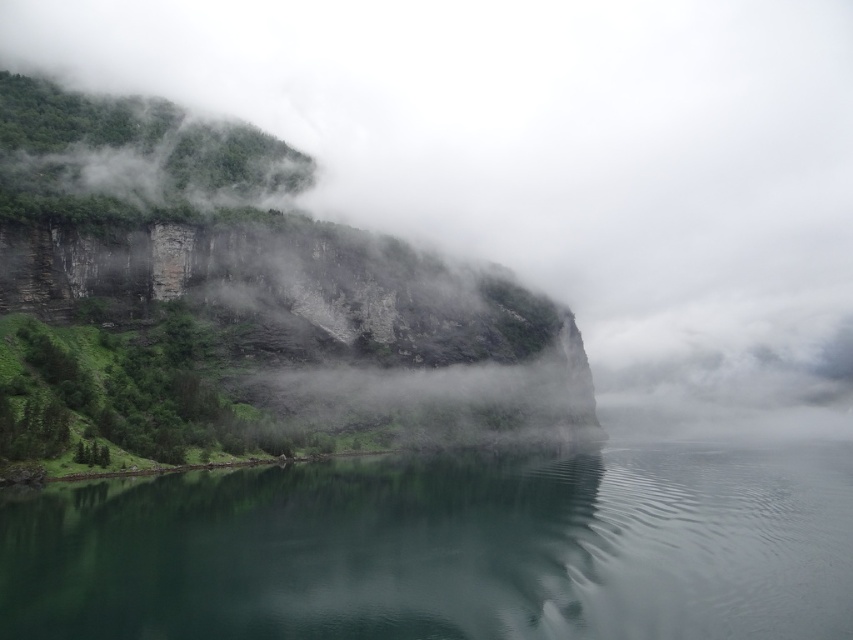
Between green reflective water at center and green mossy rock at left, which one appears on the right side from the viewer's perspective?

From the viewer's perspective, green reflective water at center appears more on the right side.

Measure the distance from green reflective water at center to green mossy rock at left.

green reflective water at center is 248.71 feet away from green mossy rock at left.

Describe the element at coordinates (445, 550) in the screenshot. I see `green reflective water at center` at that location.

The width and height of the screenshot is (853, 640). What are the coordinates of `green reflective water at center` in the screenshot? It's located at (445, 550).